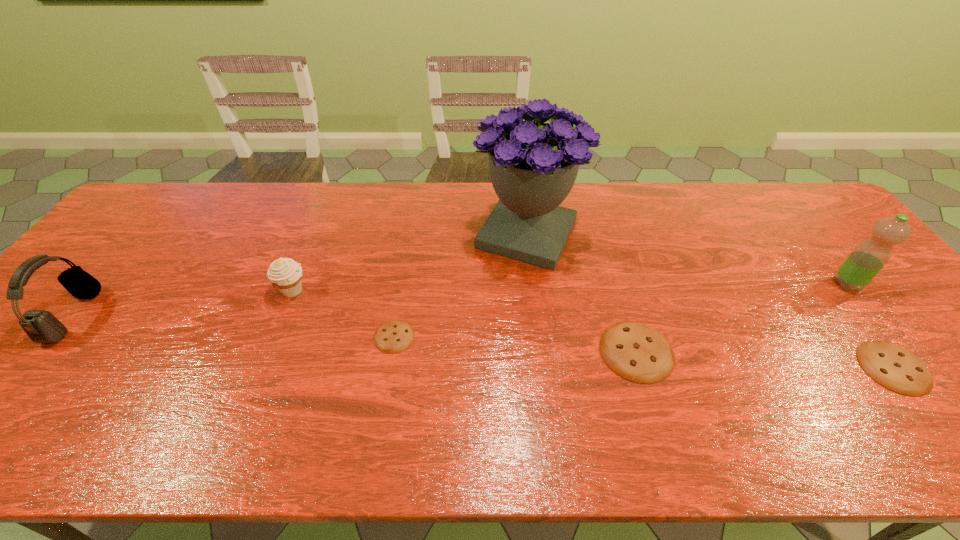
Where is `vacant place for an extra cookie on the left`? vacant place for an extra cookie on the left is located at coordinates (165, 322).